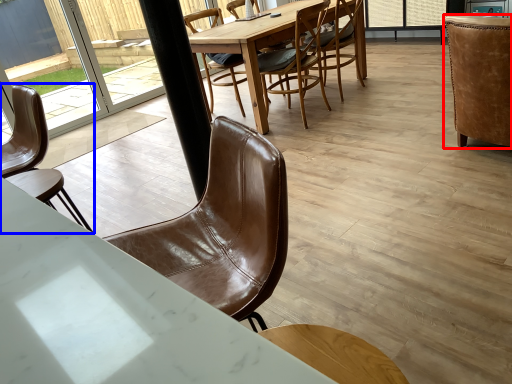
Question: Which object is closer to the camera taking this photo, chair (highlighted by a red box) or chair (highlighted by a blue box)?

Choices:
 (A) chair
 (B) chair

Answer: (B)